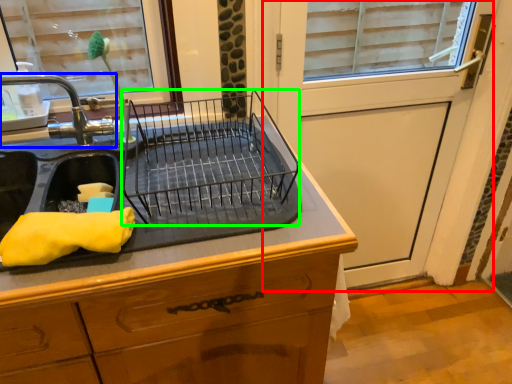
Question: Which object is the farthest from screen door (highlighted by a red box)? Choose among these: tap (highlighted by a blue box) or appliance (highlighted by a green box).

Choices:
 (A) tap
 (B) appliance

Answer: (A)